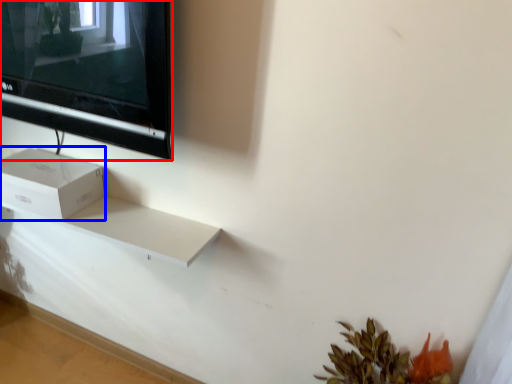
Question: Which object is further to the camera taking this photo, television (highlighted by a red box) or box (highlighted by a blue box)?

Choices:
 (A) television
 (B) box

Answer: (B)